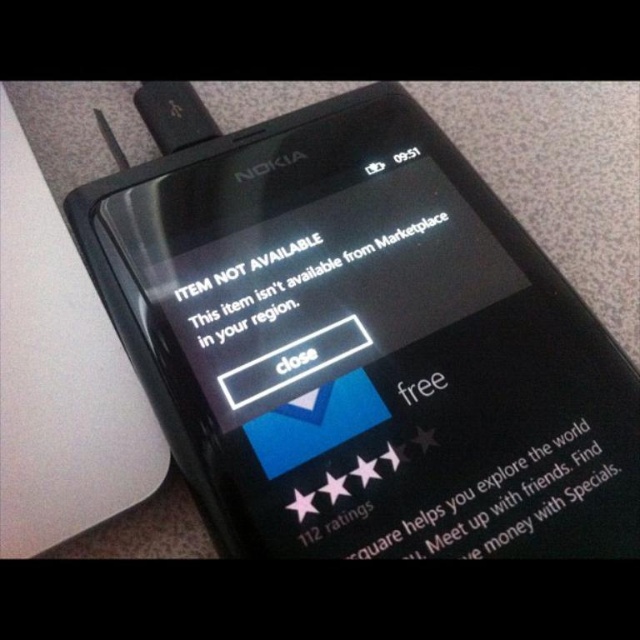
Question: In this image, where is black matte text at center located relative to white matte text at center?

Choices:
 (A) right
 (B) left

Answer: (B)

Question: Which point is closer to the camera?

Choices:
 (A) (230, 336)
 (B) (570, 426)

Answer: (B)

Question: Is black matte text at center thinner than white matte text at center?

Choices:
 (A) no
 (B) yes

Answer: (A)

Question: Is black matte text at center closer to camera compared to white matte text at center?

Choices:
 (A) no
 (B) yes

Answer: (A)

Question: Which point is farther to the camera?

Choices:
 (A) (314, 285)
 (B) (346, 552)
 (C) (468, 496)

Answer: (A)

Question: Which of the following is the closest to the observer?

Choices:
 (A) (176, 90)
 (B) (390, 252)
 (C) (424, 525)

Answer: (C)